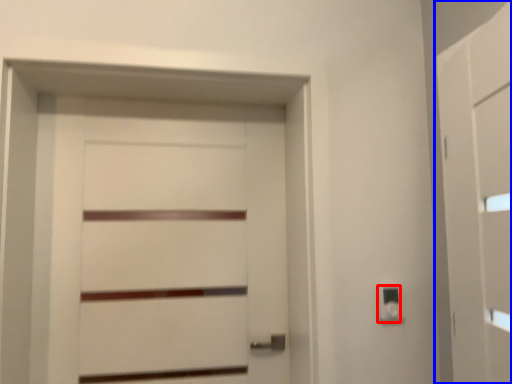
Question: Which of the following is the farthest to the observer, light switch (highlighted by a red box) or barn door (highlighted by a blue box)?

Choices:
 (A) light switch
 (B) barn door

Answer: (A)